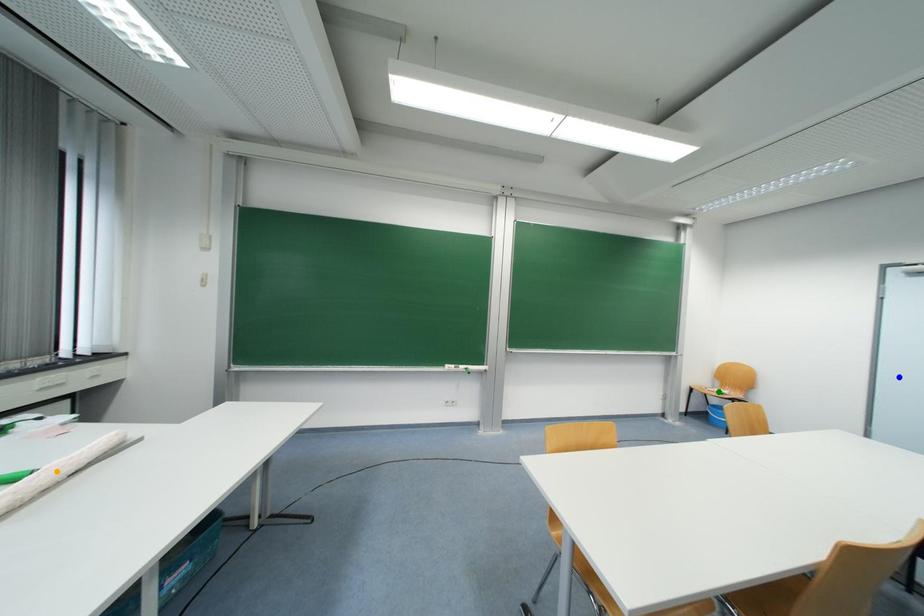
Order these from nearest to farthest:
A) green point
B) orange point
C) blue point

orange point
blue point
green point